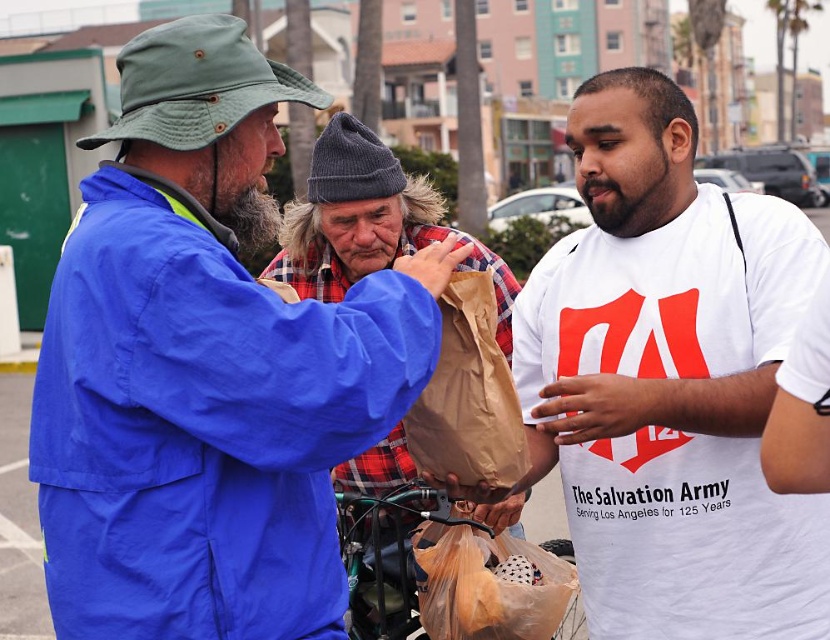
Can you confirm if blue fabric jacket at upper left is positioned below white cotton t-shirt at center?

Actually, blue fabric jacket at upper left is above white cotton t-shirt at center.

Which is more to the left, blue fabric jacket at upper left or white cotton t-shirt at center?

blue fabric jacket at upper left

Which is behind, point (417, 372) or point (702, 458)?

Point (702, 458)

This screenshot has height=640, width=830. What are the coordinates of `blue fabric jacket at upper left` in the screenshot? It's located at (206, 368).

Who is more distant from viewer, [752,529] or [438,529]?

The point [438,529] is more distant.

Which is behind, point (645, 611) or point (542, 628)?

The point (542, 628) is behind.

Where is `white cotton t-shirt at center`? Image resolution: width=830 pixels, height=640 pixels. white cotton t-shirt at center is located at coordinates (669, 381).

Does plaid fabric shirt at center appear on the right side of brown paper bag at center?

In fact, plaid fabric shirt at center is to the left of brown paper bag at center.

Based on the photo, is plaid fabric shirt at center smaller than brown paper bag at center?

Yes, plaid fabric shirt at center is smaller than brown paper bag at center.

What do you see at coordinates (369, 221) in the screenshot? I see `plaid fabric shirt at center` at bounding box center [369, 221].

The image size is (830, 640). Identify the location of plaid fabric shirt at center. (369, 221).